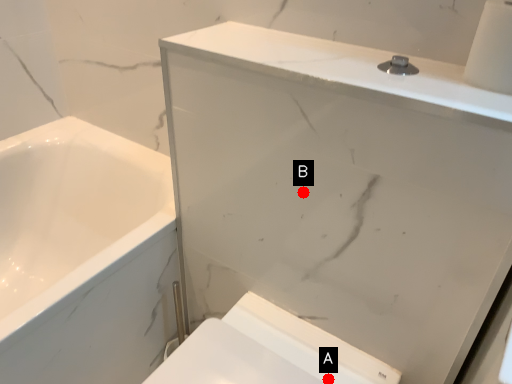
Question: Two points are circled on the image, labeled by A and B beside each circle. Which of the following is the farthest from the observer?

Choices:
 (A) A is further
 (B) B is further

Answer: (A)